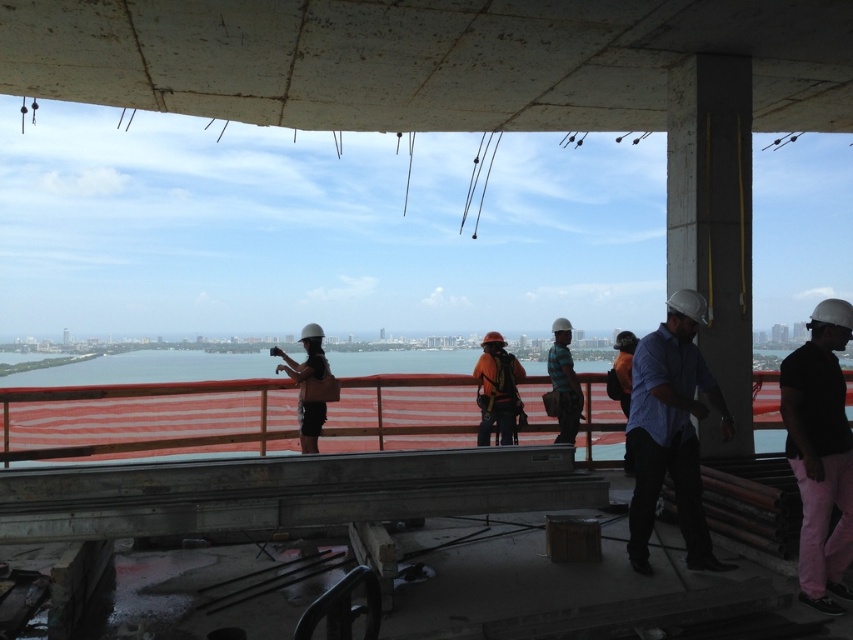
Is blue shirt at right further to the viewer compared to orange fabric safety vest at center?

No, blue shirt at right is closer to the viewer.

Is point (692, 332) farther from viewer compared to point (492, 348)?

No, (692, 332) is closer to viewer.

Identify the location of blue shirt at right. The image size is (853, 640). (670, 429).

Does orange fabric safety vest at center appear over blue plaid shirt at center?

Incorrect, orange fabric safety vest at center is not positioned above blue plaid shirt at center.

Is orange fabric safety vest at center to the right of blue plaid shirt at center from the viewer's perspective?

No, orange fabric safety vest at center is not to the right of blue plaid shirt at center.

At what (x,y) coordinates should I click in order to perform the action: click on orange fabric safety vest at center. Please return your answer as a coordinate pair (x, y). This screenshot has width=853, height=640. Looking at the image, I should click on click(x=497, y=388).

Is black matte helmet at right wider than matte black helmet at center?

Yes.

Is black matte helmet at right taller than matte black helmet at center?

Yes, black matte helmet at right is taller than matte black helmet at center.

Between point (844, 566) and point (306, 364), which one is positioned in front?

Positioned in front is point (844, 566).

Where is `black matte helmet at right`? The height and width of the screenshot is (640, 853). black matte helmet at right is located at coordinates (820, 452).